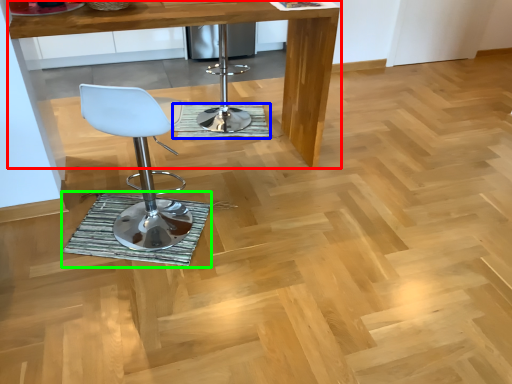
Question: Based on their relative distances, which object is nearer to table (highlighted by a red box)? Choose from mat (highlighted by a blue box) and mat (highlighted by a green box).

Choices:
 (A) mat
 (B) mat

Answer: (A)